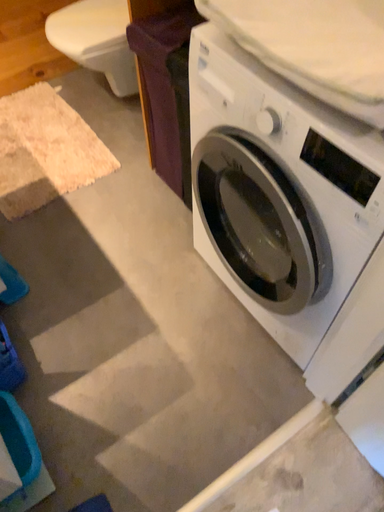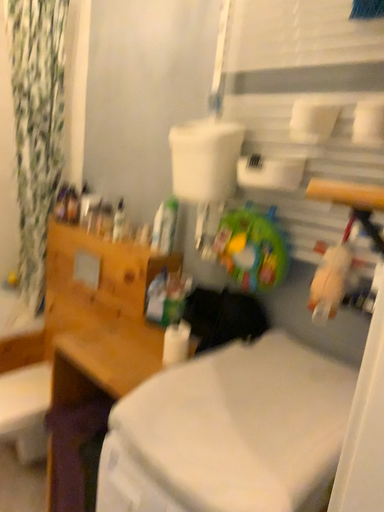
Question: Which way did the camera rotate in the video?

Choices:
 (A) rotated right
 (B) rotated left

Answer: (A)